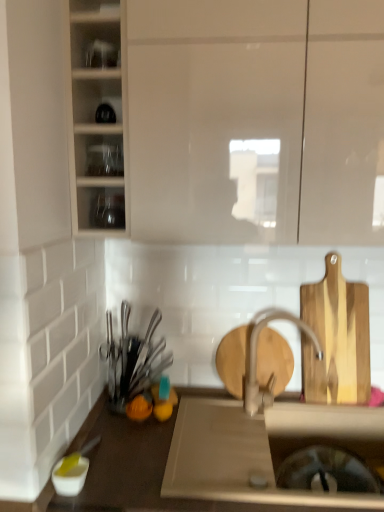
Where is `free space between matte silver faucet at center and shiny metallic utensils at left, marked as the first tableware in a right-to-left arrangement`? free space between matte silver faucet at center and shiny metallic utensils at left, marked as the first tableware in a right-to-left arrangement is located at coordinates (216, 410).